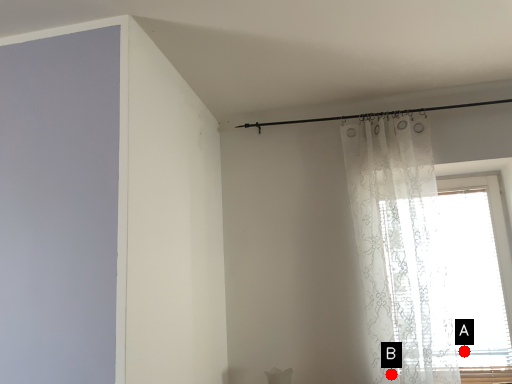
Question: Two points are circled on the image, labeled by A and B beside each circle. Among these points, which one is nearest to the camera?

Choices:
 (A) A is closer
 (B) B is closer

Answer: (B)